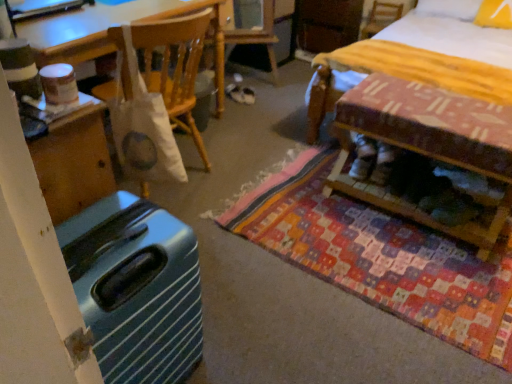
Image resolution: width=512 pixels, height=384 pixels. What are the coordinates of `vacant area that lies in front of wooden bench at lower right` in the screenshot? It's located at (426, 274).